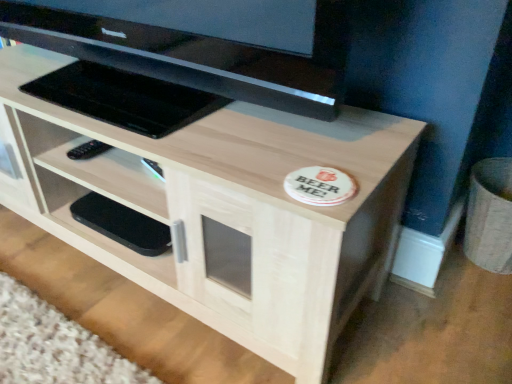
The image size is (512, 384). I want to click on black glossy television at upper center, so click(202, 44).

The height and width of the screenshot is (384, 512). Describe the element at coordinates (225, 210) in the screenshot. I see `light wood/texture tv stand at center` at that location.

The image size is (512, 384). I want to click on black glossy television at upper center, so click(x=202, y=44).

Is black matte phone at lower left located outside light wood/texture tv stand at center?

Actually, black matte phone at lower left is at least partially inside light wood/texture tv stand at center.

Is black matte phone at lower left at the left side of light wood/texture tv stand at center?

Yes.

Is black matte phone at lower left taller or shorter than light wood/texture tv stand at center?

In the image, black matte phone at lower left appears to be shorter than light wood/texture tv stand at center.

Are black matte phone at lower left and black glossy television at upper center far apart?

They are positioned close to each other.

Between black matte phone at lower left and black glossy television at upper center, which one has smaller size?

black matte phone at lower left is smaller.

Which is further, (x=102, y=247) or (x=163, y=64)?

Point (x=102, y=247)

Is black glossy television at upper center positioned with its back to light wood/texture tv stand at center?

No, black glossy television at upper center is not facing away from light wood/texture tv stand at center.

Does black glossy television at upper center have a greater width compared to light wood/texture tv stand at center?

No, black glossy television at upper center is not wider than light wood/texture tv stand at center.

Can you see black glossy television at upper center touching light wood/texture tv stand at center?

No, black glossy television at upper center is not in contact with light wood/texture tv stand at center.

The image size is (512, 384). I want to click on desk on the right of the black glossy television at upper center, so click(225, 210).

Looking at this image, could you tell me if black glossy television at upper center is facing black matte phone at lower left?

No, black glossy television at upper center is not turned towards black matte phone at lower left.

How different are the orientations of black glossy television at upper center and black matte phone at lower left in degrees?

The angular difference between black glossy television at upper center and black matte phone at lower left is 1.21 degrees.

Choose the correct answer: Is black glossy television at upper center inside black matte phone at lower left or outside it?

black glossy television at upper center is spatially situated outside black matte phone at lower left.

Is black glossy television at upper center shorter than black matte phone at lower left?

In fact, black glossy television at upper center may be taller than black matte phone at lower left.

Do you think light wood/texture tv stand at center is within black glossy television at upper center, or outside of it?

light wood/texture tv stand at center is located beyond the bounds of black glossy television at upper center.

From the picture: Measure the distance between light wood/texture tv stand at center and black glossy television at upper center.

A distance of 8.86 inches exists between light wood/texture tv stand at center and black glossy television at upper center.

Is light wood/texture tv stand at center to the left or to the right of black glossy television at upper center in the image?

In the image, light wood/texture tv stand at center appears on the right side of black glossy television at upper center.

Considering the positions of objects light wood/texture tv stand at center and black glossy television at upper center in the image provided, who is in front, light wood/texture tv stand at center or black glossy television at upper center?

black glossy television at upper center is in front.

Is light wood/texture tv stand at center completely or partially outside of black matte phone at lower left?

light wood/texture tv stand at center lies outside black matte phone at lower left's area.

Where is `shelf behind the light wood/texture tv stand at center`? The height and width of the screenshot is (384, 512). shelf behind the light wood/texture tv stand at center is located at coordinates (112, 191).

Considering the positions of point (181, 175) and point (114, 164), is point (181, 175) closer or farther from the camera than point (114, 164)?

Point (181, 175) is closer to the camera than point (114, 164).

You are a GUI agent. You are given a task and a screenshot of the screen. Output one action in this format:
    pyautogui.click(x=<x>, y=<y>)
    Task: Click on the shelf beneath the light wood/texture tv stand at center (from a real-world perspective)
    This screenshot has width=512, height=384.
    Given the screenshot: What is the action you would take?
    pyautogui.click(x=112, y=191)

Find the location of `shelf located below the black glossy television at upper center (from the image's perspective)`. shelf located below the black glossy television at upper center (from the image's perspective) is located at coordinates (112, 191).

Which object lies further to the anchor point black matte phone at lower left, black glossy television at upper center or light wood/texture tv stand at center?

black glossy television at upper center is positioned further to the anchor black matte phone at lower left.

Based on their spatial positions, is black glossy television at upper center or black matte phone at lower left closer to light wood/texture tv stand at center?

The object closer to light wood/texture tv stand at center is black matte phone at lower left.

Considering their positions, is light wood/texture tv stand at center positioned further to black matte phone at lower left than black glossy television at upper center?

Based on the image, black glossy television at upper center appears to be further to black matte phone at lower left.

Looking at the image, which one is located further to black glossy television at upper center, black matte phone at lower left or light wood/texture tv stand at center?

black matte phone at lower left.

In the scene shown: Based on their spatial positions, is black matte phone at lower left or black glossy television at upper center further from light wood/texture tv stand at center?

black glossy television at upper center is positioned further to the anchor light wood/texture tv stand at center.

When comparing their distances from black glossy television at upper center, does light wood/texture tv stand at center or black matte phone at lower left seem closer?

light wood/texture tv stand at center is closer to black glossy television at upper center.

Where is `desk positioned between black glossy television at upper center and black matte phone at lower left from near to far`? This screenshot has height=384, width=512. desk positioned between black glossy television at upper center and black matte phone at lower left from near to far is located at coordinates (225, 210).